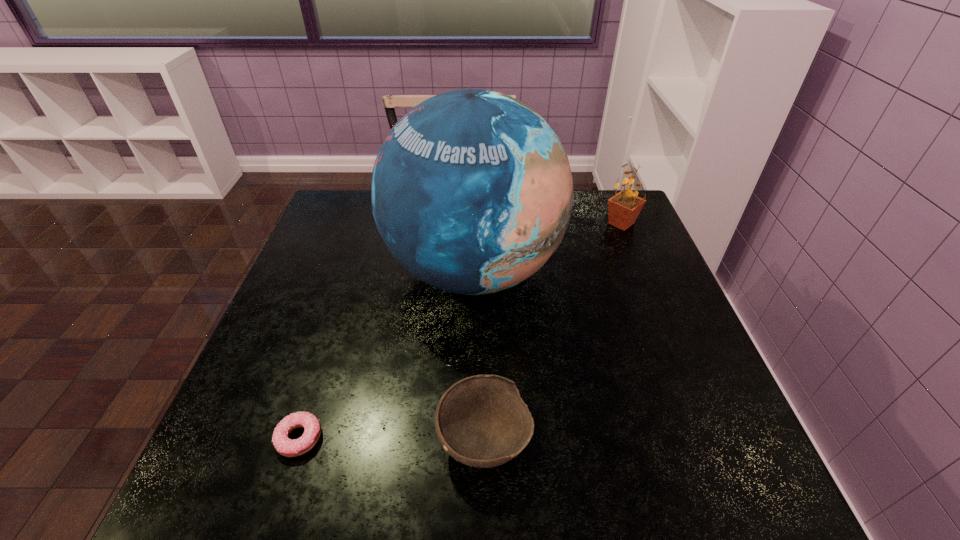
Locate an element on the screen. blank space located on the back of the third tallest object is located at coordinates (483, 294).

You are a GUI agent. You are given a task and a screenshot of the screen. Output one action in this format:
    pyautogui.click(x=<x>, y=<y>)
    Task: Click on the blank space located on the back of the leftmost object
    This screenshot has height=540, width=960.
    Given the screenshot: What is the action you would take?
    pyautogui.click(x=335, y=326)

Identify the location of globe that is at the far edge. The width and height of the screenshot is (960, 540). click(472, 192).

Identify the location of sunflower that is positioned at the far edge. The height and width of the screenshot is (540, 960). (623, 209).

The height and width of the screenshot is (540, 960). I want to click on bowl situated at the near edge, so click(x=481, y=421).

Identify the location of doughnut that is positioned at the near edge. The image size is (960, 540). (287, 447).

The width and height of the screenshot is (960, 540). Identify the location of object that is positioned at the left edge. (287, 447).

Locate an element on the screen. object located at the right edge is located at coordinates (623, 209).

The image size is (960, 540). I want to click on object situated at the near left corner, so click(287, 447).

Locate an element on the screen. The image size is (960, 540). object that is at the far right corner is located at coordinates (623, 209).